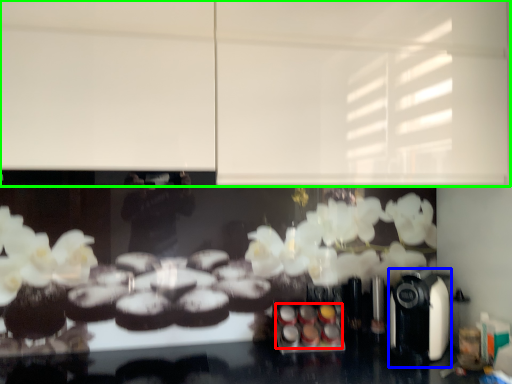
Question: Which object is positioned closest to food (highlighted by a red box)? Select from coffee machine (highlighted by a blue box) and backdrop (highlighted by a green box).

Choices:
 (A) coffee machine
 (B) backdrop

Answer: (A)